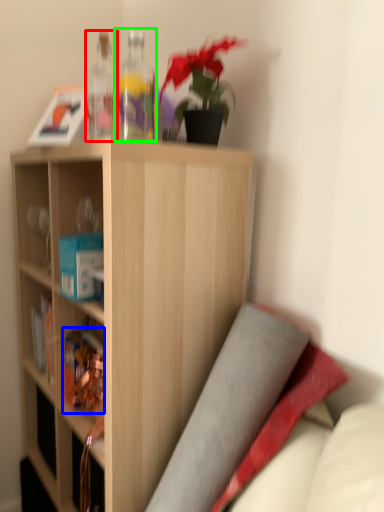
Question: Which is nearer to the bottle (highlighted by a red box)? book (highlighted by a blue box) or bottle (highlighted by a green box).

Choices:
 (A) book
 (B) bottle

Answer: (B)